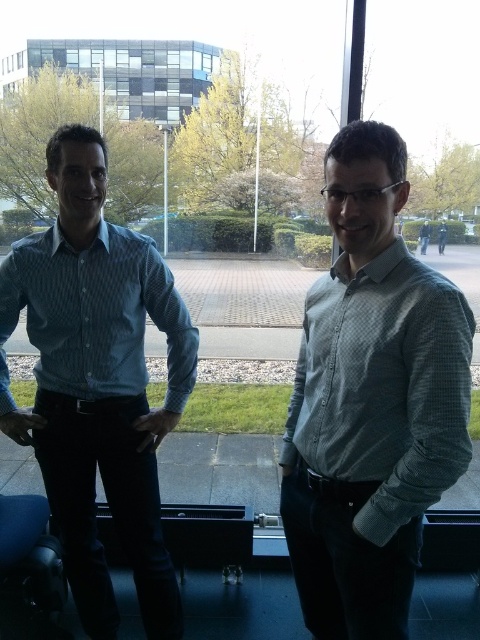
Question: Can you confirm if light blue checkered shirt at center is wider than blue checkered shirt at left?

Choices:
 (A) yes
 (B) no

Answer: (B)

Question: Does light blue checkered shirt at center appear on the left side of blue checkered shirt at left?

Choices:
 (A) yes
 (B) no

Answer: (B)

Question: Which point is closer to the camera?

Choices:
 (A) click(x=349, y=177)
 (B) click(x=70, y=237)

Answer: (A)

Question: Is light blue checkered shirt at center thinner than blue checkered shirt at left?

Choices:
 (A) no
 (B) yes

Answer: (B)

Question: Among these objects, which one is farthest from the camera?

Choices:
 (A) light blue checkered shirt at center
 (B) blue checkered shirt at left

Answer: (B)